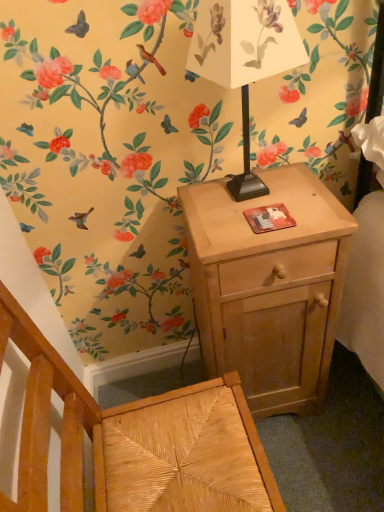
Identify the location of free space to the right of white paper lampshade at upper center. The height and width of the screenshot is (512, 384). (304, 192).